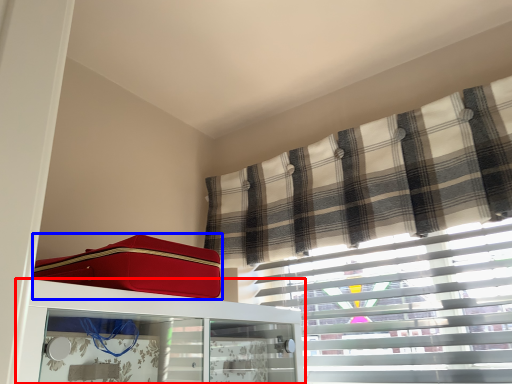
Question: Which object appears closest to the camera in this image, furniture (highlighted by a red box) or suitcase (highlighted by a blue box)?

Choices:
 (A) furniture
 (B) suitcase

Answer: (A)